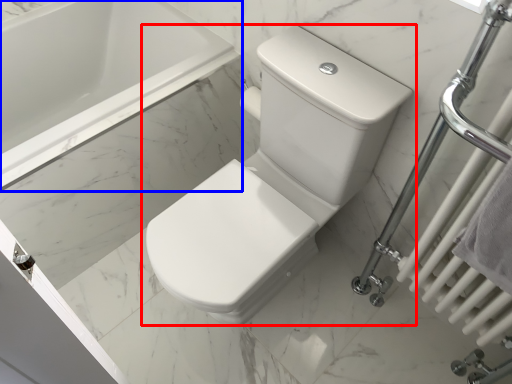
Question: Which of the following is the closest to the observer, toilet (highlighted by a red box) or bathtub (highlighted by a blue box)?

Choices:
 (A) toilet
 (B) bathtub

Answer: (A)